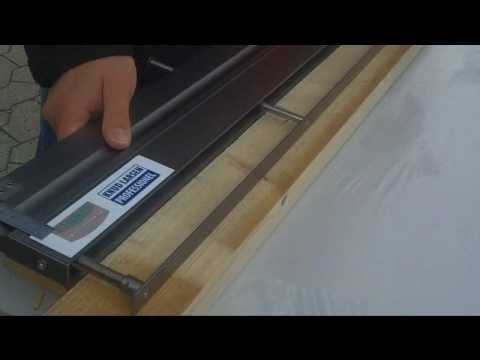
I want to click on white table, so click(425, 168).